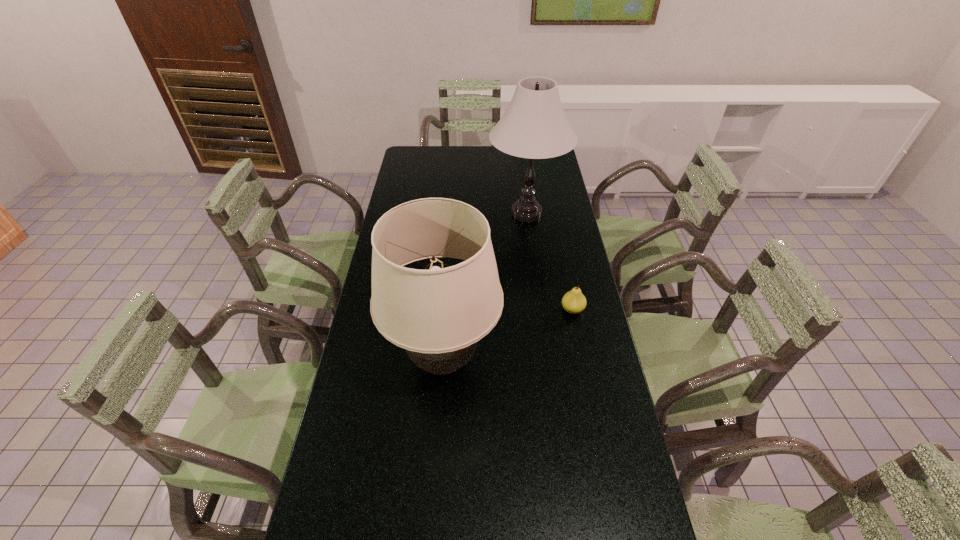
Find the location of `free space at the right edge of the desktop`. free space at the right edge of the desktop is located at coordinates (623, 460).

Locate an element on the screen. The width and height of the screenshot is (960, 540). blank space at the far right corner is located at coordinates (536, 164).

You are a GUI agent. You are given a task and a screenshot of the screen. Output one action in this format:
    pyautogui.click(x=<x>, y=<y>)
    Task: Click on the free space between the pear and the lampshade
    This screenshot has width=960, height=540.
    Given the screenshot: What is the action you would take?
    pyautogui.click(x=508, y=335)

Where is `free point between the pear and the lamp`? free point between the pear and the lamp is located at coordinates (549, 262).

Find the location of a particular element. The width and height of the screenshot is (960, 540). free space that is in between the farthest object and the pear is located at coordinates (549, 262).

The height and width of the screenshot is (540, 960). Find the location of `object that can be found as the closest to the shortest object`. object that can be found as the closest to the shortest object is located at coordinates (438, 316).

Identify which object is the nearest to the pear. Please provide its 2D coordinates. Your answer should be formatted as a tuple, i.e. [(x, y)], where the tuple contains the x and y coordinates of a point satisfying the conditions above.

[(438, 316)]

Where is `free space in the image that satisfies the following two spatial constraints: 1. on the back side of the shortest object; 2. on the right side of the lampshade`? This screenshot has height=540, width=960. free space in the image that satisfies the following two spatial constraints: 1. on the back side of the shortest object; 2. on the right side of the lampshade is located at coordinates (446, 310).